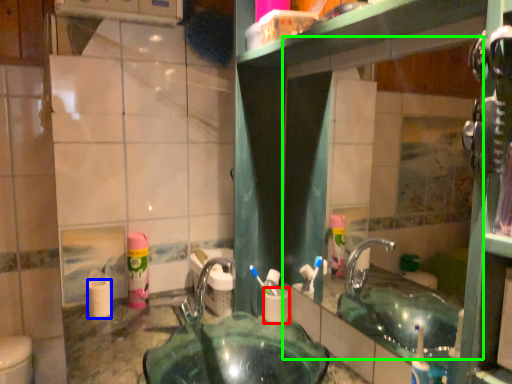
Question: Which object is positioned farthest from toilet paper (highlighted by a red box)? Select from toilet paper (highlighted by a blue box) and mirror (highlighted by a green box).

Choices:
 (A) toilet paper
 (B) mirror

Answer: (B)